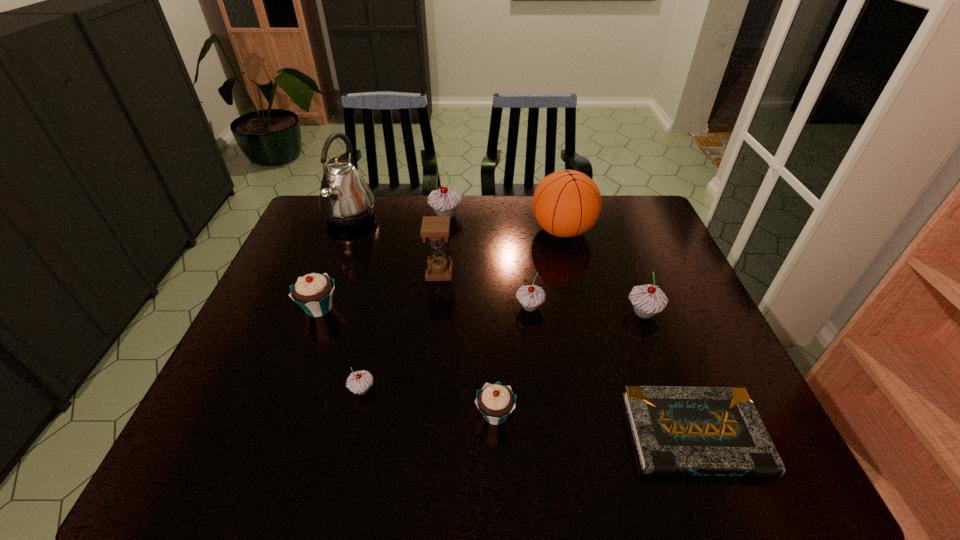
Where is `kettle at the left edge`? This screenshot has width=960, height=540. kettle at the left edge is located at coordinates (345, 199).

Identify the location of cupcake located in the left edge section of the desktop. The width and height of the screenshot is (960, 540). (313, 292).

Image resolution: width=960 pixels, height=540 pixels. I want to click on cupcake located in the right edge section of the desktop, so coord(647,300).

Find the location of a particular element. The height and width of the screenshot is (540, 960). notebook that is at the right edge is located at coordinates (717, 431).

Where is `object present at the far left corner`? Image resolution: width=960 pixels, height=540 pixels. object present at the far left corner is located at coordinates (345, 199).

Where is `object that is at the near right corner`? The height and width of the screenshot is (540, 960). object that is at the near right corner is located at coordinates (717, 431).

Locate an element on the screen. This screenshot has width=960, height=540. vacant point at the far edge is located at coordinates [537, 226].

Find the location of `free spot at the near edge of the desktop`. free spot at the near edge of the desktop is located at coordinates (568, 455).

Locate an element on the screen. Image resolution: width=960 pixels, height=540 pixels. vacant region at the left edge of the desktop is located at coordinates (291, 359).

In the image, there is a desktop. Where is `vacant space at the right edge`? The width and height of the screenshot is (960, 540). vacant space at the right edge is located at coordinates (660, 273).